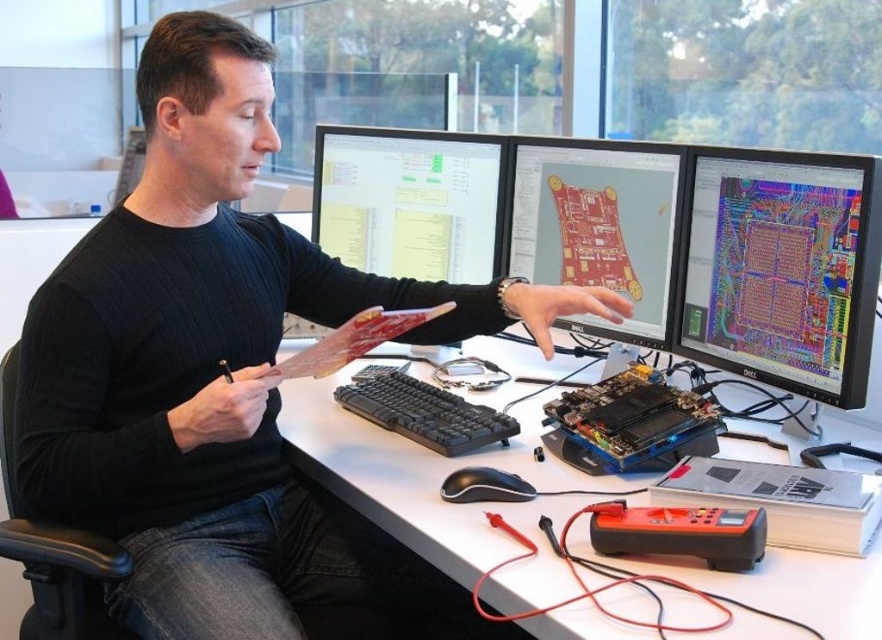
Question: Which of the following is the closest to the observer?

Choices:
 (A) (731, 218)
 (B) (154, 492)

Answer: (B)

Question: Can you confirm if white plastic computer desk at center is positioned to the right of black plastic keyboard at center?

Choices:
 (A) no
 (B) yes

Answer: (B)

Question: Among these points, which one is nearest to the camera?

Choices:
 (A) (827, 172)
 (B) (312, 328)
 (C) (776, 460)
 (D) (656, 320)

Answer: (A)

Question: Is matte black shirt at center bigger than white plastic computer desk at center?

Choices:
 (A) no
 (B) yes

Answer: (B)

Question: Does matte plastic computer monitor at center appear over matte plastic monitor at center?

Choices:
 (A) no
 (B) yes

Answer: (A)

Question: Estimate the real-world distances between objects in this image. Which object is closer to the matte plastic monitor at center?

Choices:
 (A) matte black monitor at right
 (B) black plastic keyboard at center
 (C) matte black shirt at center

Answer: (B)